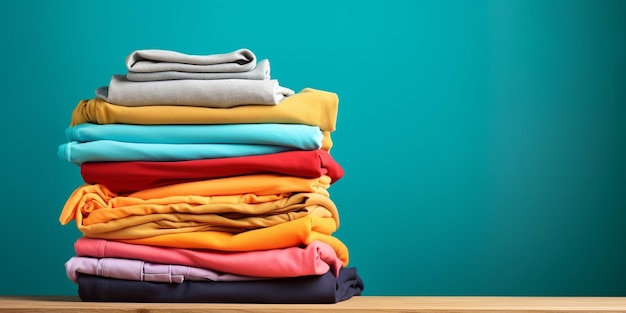
This screenshot has height=313, width=626. What are the coordinates of `folded clothing items` in the screenshot? It's located at (225, 57), (310, 99), (284, 137), (285, 159), (260, 180), (245, 210), (255, 234), (260, 254), (131, 266), (155, 287).